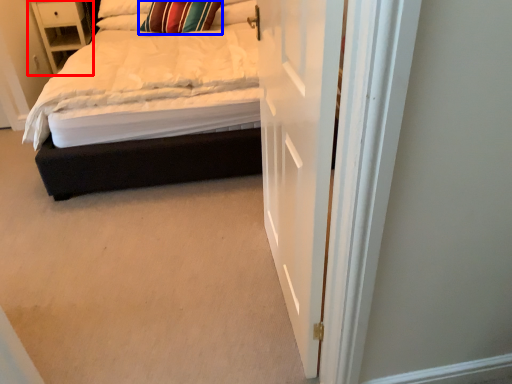
Question: Which object is further to the camera taking this photo, nightstand (highlighted by a red box) or pillow (highlighted by a blue box)?

Choices:
 (A) nightstand
 (B) pillow

Answer: (A)